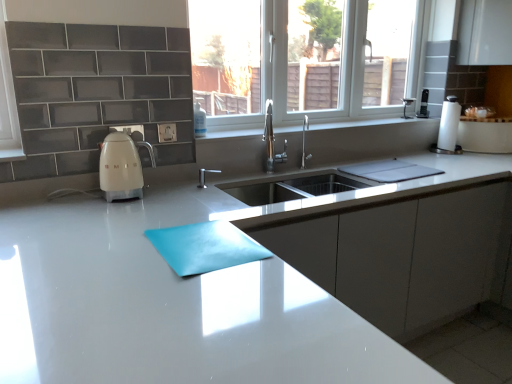
Question: Does white glossy kettle at left have a lesser width compared to white glossy countertop at center?

Choices:
 (A) yes
 (B) no

Answer: (A)

Question: Can you confirm if white glossy kettle at left is smaller than white glossy countertop at center?

Choices:
 (A) yes
 (B) no

Answer: (A)

Question: Is white glossy kettle at left wider than white glossy countertop at center?

Choices:
 (A) yes
 (B) no

Answer: (B)

Question: From the image's perspective, is white glossy kettle at left on white glossy countertop at center?

Choices:
 (A) no
 (B) yes

Answer: (B)

Question: Does white glossy kettle at left lie in front of white glossy countertop at center?

Choices:
 (A) no
 (B) yes

Answer: (A)

Question: From the image's perspective, is polished chrome tap at center positioned above or below teal glossy placemat at center?

Choices:
 (A) above
 (B) below

Answer: (A)

Question: Looking at their shapes, would you say polished chrome tap at center is wider or thinner than teal glossy placemat at center?

Choices:
 (A) thin
 (B) wide

Answer: (A)

Question: Is point (302, 150) closer or farther from the camera than point (236, 253)?

Choices:
 (A) closer
 (B) farther

Answer: (B)

Question: In terms of size, does polished chrome tap at center appear bigger or smaller than teal glossy placemat at center?

Choices:
 (A) big
 (B) small

Answer: (B)

Question: Considering their positions, is white paper towel at right located in front of or behind clear plastic soap dispenser at upper center?

Choices:
 (A) behind
 (B) front

Answer: (A)

Question: Is white paper towel at right spatially inside clear plastic soap dispenser at upper center, or outside of it?

Choices:
 (A) inside
 (B) outside

Answer: (B)

Question: Is white paper towel at right taller or shorter than clear plastic soap dispenser at upper center?

Choices:
 (A) tall
 (B) short

Answer: (A)

Question: Is white paper towel at right to the left or to the right of clear plastic soap dispenser at upper center in the image?

Choices:
 (A) left
 (B) right

Answer: (B)

Question: Considering the positions of white glossy window sill at center and polished chrome tap at center in the image, is white glossy window sill at center bigger or smaller than polished chrome tap at center?

Choices:
 (A) big
 (B) small

Answer: (A)

Question: Do you think white glossy window sill at center is within polished chrome tap at center, or outside of it?

Choices:
 (A) inside
 (B) outside

Answer: (B)